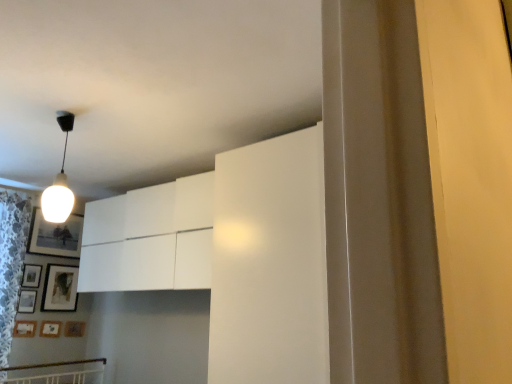
Based on the photo, in order to face wooden picture frame at lower left, arranged as the 2th picture frame when ordered from the bottom, should I rotate leftwards or rightwards?

A 25.436 degree turn to the left will do.

This screenshot has width=512, height=384. What do you see at coordinates (59, 182) in the screenshot? I see `white glossy light bulb at upper left` at bounding box center [59, 182].

Locate an element on the screen. This screenshot has height=384, width=512. white glossy light bulb at upper left is located at coordinates (59, 182).

The image size is (512, 384). What do you see at coordinates (24, 328) in the screenshot?
I see `wooden matte picture frame at lower left, the 3th picture frame positioned from the bottom` at bounding box center [24, 328].

In the scene shown: In order to face wooden matte picture frame at lower left, arranged as the 1th picture frame when ordered from the bottom, should I rotate leftwards or rightwards?

To face it directly, rotate left by 22.751 degrees.

How much space does wooden matte picture frame at lower left, placed as the seventh picture frame when sorted from top to bottom, occupy horizontally?

The width of wooden matte picture frame at lower left, placed as the seventh picture frame when sorted from top to bottom, is 2.33 centimeters.

What do you see at coordinates (55, 236) in the screenshot? I see `matte black picture frame at upper left, the seventh picture frame ordered from the bottom` at bounding box center [55, 236].

The width and height of the screenshot is (512, 384). Describe the element at coordinates (60, 288) in the screenshot. I see `matte black picture frame at lower left, which ranks as the 3th picture frame in top-to-bottom order` at that location.

Locate an element on the screen. wooden picture frame at lower left, the 6th picture frame positioned from the bottom is located at coordinates (31, 276).

What do you see at coordinates (27, 301) in the screenshot? I see `wooden picture frame at lower left, arranged as the 4th picture frame when viewed from the top` at bounding box center [27, 301].

The image size is (512, 384). In order to click on wooden picture frame at lower left, arranged as the 2th picture frame when ordered from the bottom in this screenshot , I will do `click(50, 329)`.

Is wooden picture frame at lower left, arranged as the 4th picture frame when viewed from the top, thinner than wooden matte picture frame at lower left, arranged as the 1th picture frame when ordered from the bottom?

Yes.

How different are the orientations of wooden picture frame at lower left, arranged as the 4th picture frame when viewed from the top, and wooden matte picture frame at lower left, placed as the seventh picture frame when sorted from top to bottom, in degrees?

There is a 0.00397-degree angle between the facing directions of wooden picture frame at lower left, arranged as the 4th picture frame when viewed from the top, and wooden matte picture frame at lower left, placed as the seventh picture frame when sorted from top to bottom.

From their relative heights in the image, would you say wooden picture frame at lower left, the fourth picture frame when ordered from bottom to top, is taller or shorter than wooden matte picture frame at lower left, arranged as the 1th picture frame when ordered from the bottom?

wooden picture frame at lower left, the fourth picture frame when ordered from bottom to top, is taller than wooden matte picture frame at lower left, arranged as the 1th picture frame when ordered from the bottom.

Is wooden picture frame at lower left, the fourth picture frame when ordered from bottom to top, situated inside wooden matte picture frame at lower left, arranged as the 1th picture frame when ordered from the bottom, or outside?

The correct answer is: outside.

Does point (50, 326) come closer to viewer compared to point (77, 245)?

Yes, it is in front of point (77, 245).

Could you tell me if wooden picture frame at lower left, which ranks as the sixth picture frame in top-to-bottom order, is facing matte black picture frame at upper left, acting as the first picture frame starting from the top?

No, wooden picture frame at lower left, which ranks as the sixth picture frame in top-to-bottom order, is not aimed at matte black picture frame at upper left, acting as the first picture frame starting from the top.

Which object is further away from the camera taking this photo, wooden picture frame at lower left, which ranks as the sixth picture frame in top-to-bottom order, or matte black picture frame at upper left, acting as the first picture frame starting from the top?

wooden picture frame at lower left, which ranks as the sixth picture frame in top-to-bottom order, is behind.

You are a GUI agent. You are given a task and a screenshot of the screen. Output one action in this format:
    pyautogui.click(x=<x>, y=<y>)
    Task: Click on the 1st picture frame in front when counting from the wooden picture frame at lower left, arranged as the 2th picture frame when ordered from the bottom
    This screenshot has width=512, height=384.
    Given the screenshot: What is the action you would take?
    pyautogui.click(x=55, y=236)

Considering the points (52, 220) and (9, 291), which point is in front, point (52, 220) or point (9, 291)?

The point (52, 220) is closer to the camera.

Does white glossy light bulb at upper left appear on the left side of white lace curtain at left?

In fact, white glossy light bulb at upper left is to the right of white lace curtain at left.

Does white glossy light bulb at upper left have a smaller size compared to white lace curtain at left?

Indeed, white glossy light bulb at upper left has a smaller size compared to white lace curtain at left.

From the image's perspective, who appears lower, wooden picture frame at lower left, the fourth picture frame when ordered from bottom to top, or wooden picture frame at lower left, the 6th picture frame positioned from the bottom?

wooden picture frame at lower left, the fourth picture frame when ordered from bottom to top, from the image's perspective.

From a real-world perspective, is wooden picture frame at lower left, arranged as the 4th picture frame when viewed from the top, on top of wooden picture frame at lower left, the 6th picture frame positioned from the bottom?

No, from a real-world perspective, wooden picture frame at lower left, arranged as the 4th picture frame when viewed from the top, is not on top of wooden picture frame at lower left, the 6th picture frame positioned from the bottom.

In order to click on picture frame that is the 1st one when counting forward from the wooden picture frame at lower left, placed as the 2th picture frame when sorted from top to bottom in this screenshot , I will do `click(27, 301)`.

Is wooden picture frame at lower left, the fourth picture frame when ordered from bottom to top, positioned behind wooden picture frame at lower left, placed as the 2th picture frame when sorted from top to bottom?

No, it is not.

Are white glossy light bulb at upper left and wooden picture frame at lower left, the 6th picture frame positioned from the bottom, located far from each other?

Yes, white glossy light bulb at upper left is far from wooden picture frame at lower left, the 6th picture frame positioned from the bottom.

Is wooden picture frame at lower left, the 6th picture frame positioned from the bottom, a part of white glossy light bulb at upper left?

No, wooden picture frame at lower left, the 6th picture frame positioned from the bottom, is not surrounded by white glossy light bulb at upper left.

How distant is white glossy light bulb at upper left from wooden picture frame at lower left, the 6th picture frame positioned from the bottom?

They are 6.29 feet apart.

Does white glossy light bulb at upper left lie behind wooden picture frame at lower left, the 6th picture frame positioned from the bottom?

No.

Is wooden picture frame at lower left, the fourth picture frame when ordered from bottom to top, taller than white lace curtain at left?

Incorrect, the height of wooden picture frame at lower left, the fourth picture frame when ordered from bottom to top, is not larger of that of white lace curtain at left.

Could you tell me if wooden picture frame at lower left, the fourth picture frame when ordered from bottom to top, is turned towards white lace curtain at left?

No, wooden picture frame at lower left, the fourth picture frame when ordered from bottom to top, is not aimed at white lace curtain at left.

Image resolution: width=512 pixels, height=384 pixels. I want to click on curtain above the wooden picture frame at lower left, the fourth picture frame when ordered from bottom to top (from the image's perspective), so click(x=11, y=261).

Which object is positioned more to the left, matte black picture frame at lower left, placed as the 5th picture frame when sorted from bottom to top, or wooden matte picture frame at lower left, which is the 5th picture frame in top-to-bottom order?

Positioned to the left is wooden matte picture frame at lower left, which is the 5th picture frame in top-to-bottom order.

Which object is further away from the camera, matte black picture frame at lower left, which ranks as the 3th picture frame in top-to-bottom order, or wooden matte picture frame at lower left, the 3th picture frame positioned from the bottom?

matte black picture frame at lower left, which ranks as the 3th picture frame in top-to-bottom order, is further from the camera.

Which object is thinner, matte black picture frame at lower left, placed as the 5th picture frame when sorted from bottom to top, or wooden matte picture frame at lower left, which is the 5th picture frame in top-to-bottom order?

Thinner between the two is wooden matte picture frame at lower left, which is the 5th picture frame in top-to-bottom order.

How different are the orientations of matte black picture frame at lower left, which ranks as the 3th picture frame in top-to-bottom order, and wooden matte picture frame at lower left, the 3th picture frame positioned from the bottom, in degrees?

They differ by 0.298 degrees in their facing directions.

You are a GUI agent. You are given a task and a screenshot of the screen. Output one action in this format:
    pyautogui.click(x=<x>, y=<y>)
    Task: Click on the picture frame that is the 3rd object directly below the wooden picture frame at lower left, the fourth picture frame when ordered from bottom to top (from a real-world perspective)
    
    Given the screenshot: What is the action you would take?
    pyautogui.click(x=74, y=328)

At what (x,y) coordinates should I click in order to perform the action: click on the 5th picture frame positioned above the wooden picture frame at lower left, which ranks as the sixth picture frame in top-to-bottom order (from a real-world perspective). Please return your answer as a coordinate pair (x, y). This screenshot has width=512, height=384. Looking at the image, I should click on (x=55, y=236).

Considering their positions, is wooden picture frame at lower left, arranged as the 4th picture frame when viewed from the top, positioned further to white lace curtain at left than wooden picture frame at lower left, which ranks as the sixth picture frame in top-to-bottom order?

wooden picture frame at lower left, which ranks as the sixth picture frame in top-to-bottom order, is further to white lace curtain at left.

Which object lies further to the anchor point wooden picture frame at lower left, arranged as the 4th picture frame when viewed from the top, wooden matte picture frame at lower left, arranged as the 1th picture frame when ordered from the bottom, or white glossy light bulb at upper left?

Based on the image, white glossy light bulb at upper left appears to be further to wooden picture frame at lower left, arranged as the 4th picture frame when viewed from the top.

Based on their spatial positions, is wooden matte picture frame at lower left, the 3th picture frame positioned from the bottom, or wooden picture frame at lower left, placed as the 2th picture frame when sorted from top to bottom, closer to matte black picture frame at lower left, placed as the 5th picture frame when sorted from bottom to top?

The object closer to matte black picture frame at lower left, placed as the 5th picture frame when sorted from bottom to top, is wooden picture frame at lower left, placed as the 2th picture frame when sorted from top to bottom.

Based on the photo, which object lies further to the anchor point matte black picture frame at upper left, the seventh picture frame ordered from the bottom, matte black picture frame at lower left, placed as the 5th picture frame when sorted from bottom to top, or wooden picture frame at lower left, placed as the 2th picture frame when sorted from top to bottom?

wooden picture frame at lower left, placed as the 2th picture frame when sorted from top to bottom, is positioned further to the anchor matte black picture frame at upper left, the seventh picture frame ordered from the bottom.

From the image, which object appears to be farther from white lace curtain at left, wooden picture frame at lower left, arranged as the 4th picture frame when viewed from the top, or wooden picture frame at lower left, the 6th picture frame positioned from the bottom?

wooden picture frame at lower left, arranged as the 4th picture frame when viewed from the top, is positioned further to the anchor white lace curtain at left.

Estimate the real-world distances between objects in this image. Which object is further from matte black picture frame at lower left, which ranks as the 3th picture frame in top-to-bottom order, white glossy light bulb at upper left or wooden picture frame at lower left, which ranks as the sixth picture frame in top-to-bottom order?

white glossy light bulb at upper left is further to matte black picture frame at lower left, which ranks as the 3th picture frame in top-to-bottom order.

Considering their positions, is matte black picture frame at lower left, which ranks as the 3th picture frame in top-to-bottom order, positioned further to wooden matte picture frame at lower left, arranged as the 1th picture frame when ordered from the bottom, than matte black picture frame at upper left, the seventh picture frame ordered from the bottom?

The object further to wooden matte picture frame at lower left, arranged as the 1th picture frame when ordered from the bottom, is matte black picture frame at upper left, the seventh picture frame ordered from the bottom.

From the image, which object appears to be nearer to wooden matte picture frame at lower left, the 3th picture frame positioned from the bottom, wooden matte picture frame at lower left, arranged as the 1th picture frame when ordered from the bottom, or white glossy light bulb at upper left?

wooden matte picture frame at lower left, arranged as the 1th picture frame when ordered from the bottom, is positioned closer to the anchor wooden matte picture frame at lower left, the 3th picture frame positioned from the bottom.

Identify the location of curtain between matte black picture frame at upper left, acting as the first picture frame starting from the top, and wooden matte picture frame at lower left, the 3th picture frame positioned from the bottom, from top to bottom. (11, 261).

Locate an element on the screen. picture frame between white glossy light bulb at upper left and wooden picture frame at lower left, arranged as the 4th picture frame when viewed from the top, from front to back is located at coordinates (24, 328).

Where is `curtain between matte black picture frame at upper left, the seventh picture frame ordered from the bottom, and wooden picture frame at lower left, arranged as the 2th picture frame when ordered from the bottom, in the up-down direction`? This screenshot has width=512, height=384. curtain between matte black picture frame at upper left, the seventh picture frame ordered from the bottom, and wooden picture frame at lower left, arranged as the 2th picture frame when ordered from the bottom, in the up-down direction is located at coordinates (11, 261).

Image resolution: width=512 pixels, height=384 pixels. Identify the location of curtain between white glossy light bulb at upper left and wooden matte picture frame at lower left, which is the 5th picture frame in top-to-bottom order, along the z-axis. (x=11, y=261).